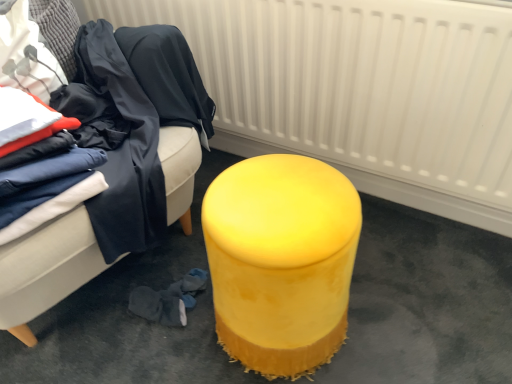
Question: From a real-world perspective, is velvet yellow ottoman at right above or below yellow velvet ottoman at center?

Choices:
 (A) below
 (B) above

Answer: (B)

Question: In the image, is velvet yellow ottoman at right on the left side or the right side of yellow velvet ottoman at center?

Choices:
 (A) left
 (B) right

Answer: (A)

Question: Estimate the real-world distances between objects in this image. Which object is closer to the dark blue fabric at left?

Choices:
 (A) yellow velvet ottoman at center
 (B) velvet yellow ottoman at right
 (C) white textured radiator at upper center
 (D) yellow velvet ottoman at center

Answer: (C)

Question: Which of these objects is positioned farthest from the white textured radiator at upper center?

Choices:
 (A) yellow velvet ottoman at center
 (B) velvet yellow ottoman at right
 (C) dark blue fabric at left
 (D) yellow velvet ottoman at center

Answer: (B)